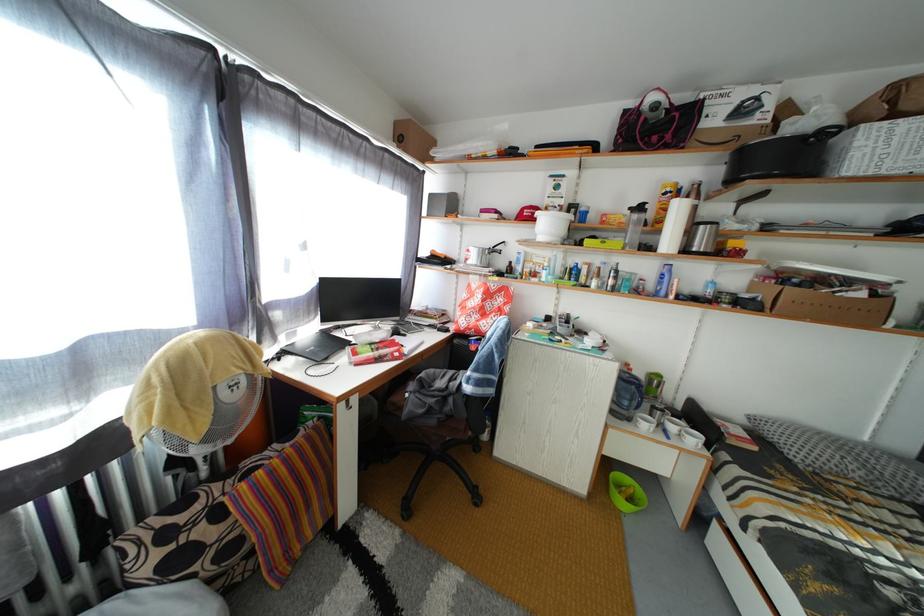
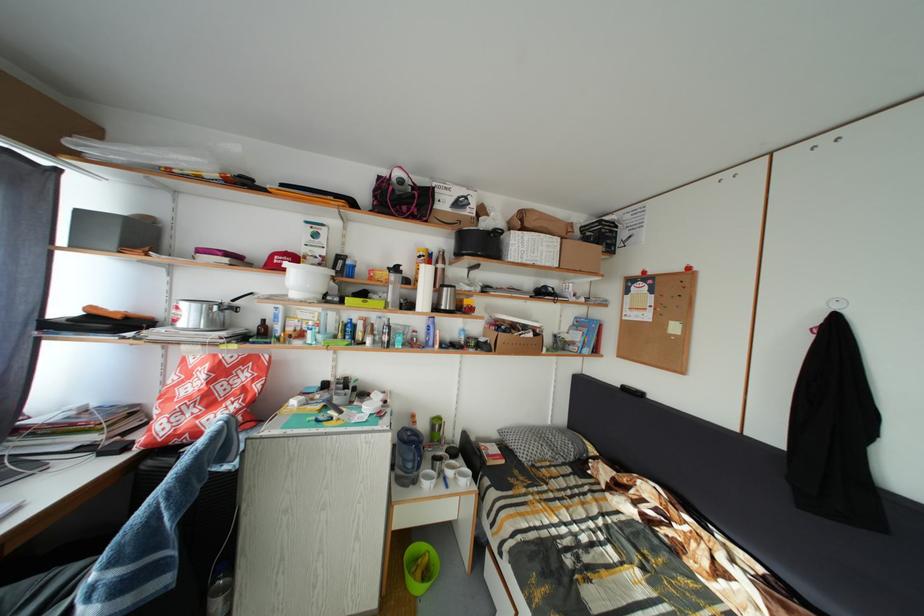
Locate, in the second image, the point that corresponds to pixel 681 434 in the first image.

(458, 480)